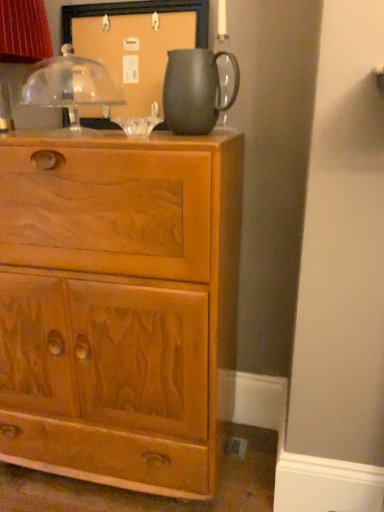
Question: Does matte black pitcher at upper center have a greater height compared to matte black pitcher at upper center?

Choices:
 (A) no
 (B) yes

Answer: (A)

Question: From a real-world perspective, is matte black pitcher at upper center under matte black pitcher at upper center?

Choices:
 (A) no
 (B) yes

Answer: (B)

Question: Could you tell me if matte black pitcher at upper center is turned towards matte black pitcher at upper center?

Choices:
 (A) no
 (B) yes

Answer: (A)

Question: From the image's perspective, would you say matte black pitcher at upper center is shown under matte black pitcher at upper center?

Choices:
 (A) yes
 (B) no

Answer: (A)

Question: Considering the relative sizes of matte black pitcher at upper center and matte black pitcher at upper center in the image provided, is matte black pitcher at upper center wider than matte black pitcher at upper center?

Choices:
 (A) yes
 (B) no

Answer: (A)

Question: Is matte black pitcher at upper center at the right side of matte black pitcher at upper center?

Choices:
 (A) yes
 (B) no

Answer: (A)

Question: Is the position of matte black pitcher at upper center more distant than that of matte black pitcher at upper center?

Choices:
 (A) no
 (B) yes

Answer: (B)

Question: Does matte black pitcher at upper center have a greater width compared to matte black pitcher at upper center?

Choices:
 (A) yes
 (B) no

Answer: (B)

Question: From a real-world perspective, is matte black pitcher at upper center on matte black pitcher at upper center?

Choices:
 (A) yes
 (B) no

Answer: (A)

Question: Could you tell me if matte black pitcher at upper center is turned towards matte black pitcher at upper center?

Choices:
 (A) no
 (B) yes

Answer: (B)

Question: From the image's perspective, is matte black pitcher at upper center under matte black pitcher at upper center?

Choices:
 (A) no
 (B) yes

Answer: (A)

Question: Is matte black pitcher at upper center taller than matte black pitcher at upper center?

Choices:
 (A) yes
 (B) no

Answer: (A)

Question: Does matte black pitcher at upper center appear on the right side of light brown wood chest of drawers at center?

Choices:
 (A) yes
 (B) no

Answer: (A)